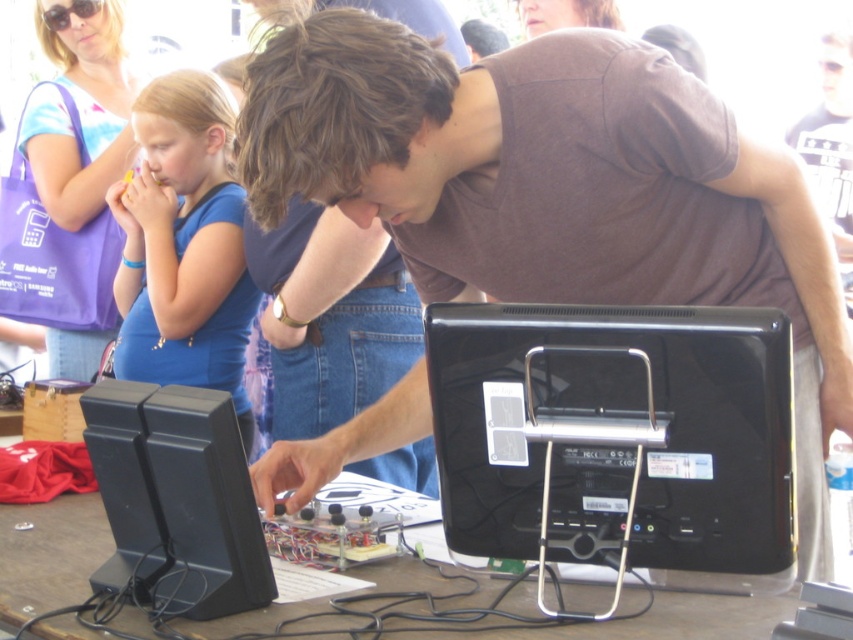
Question: Which object is farther from the camera taking this photo?

Choices:
 (A) black plastic table at center
 (B) purple fabric bag at upper left
 (C) black plastic monitor at center
 (D) blue fabric shirt at upper left

Answer: (B)

Question: Which of the following is the farthest from the observer?

Choices:
 (A) blue fabric shirt at upper left
 (B) black plastic monitor at center

Answer: (A)

Question: Is black plastic table at center behind purple fabric bag at upper left?

Choices:
 (A) no
 (B) yes

Answer: (A)

Question: Is blue fabric shirt at upper left wider than purple fabric bag at upper left?

Choices:
 (A) yes
 (B) no

Answer: (A)

Question: Which object is farther from the camera taking this photo?

Choices:
 (A) black plastic monitor at center
 (B) blue fabric shirt at upper left
 (C) matte brown shirt at center
 (D) black plastic table at center

Answer: (B)

Question: Is matte brown shirt at center positioned at the back of black plastic table at center?

Choices:
 (A) yes
 (B) no

Answer: (A)